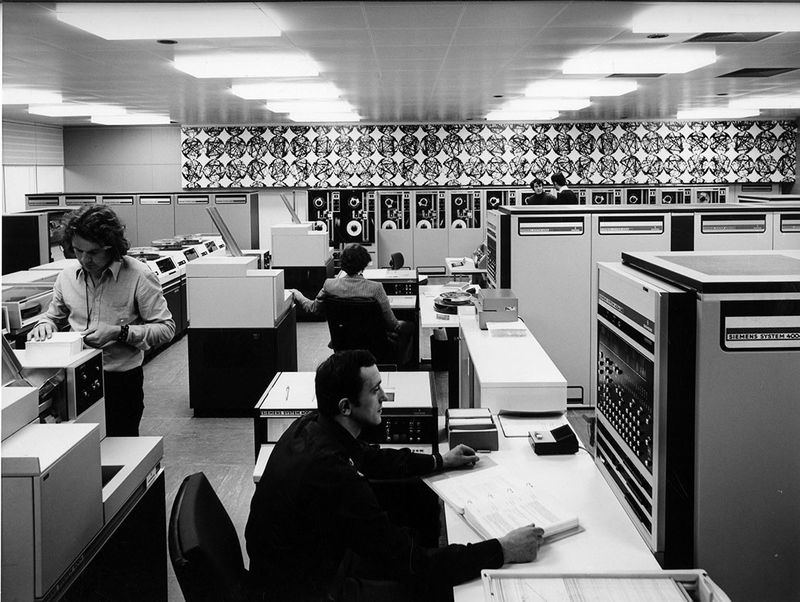
Image resolution: width=800 pixels, height=602 pixels. Find the location of `printer`. printer is located at coordinates (222, 283), (294, 252), (54, 498).